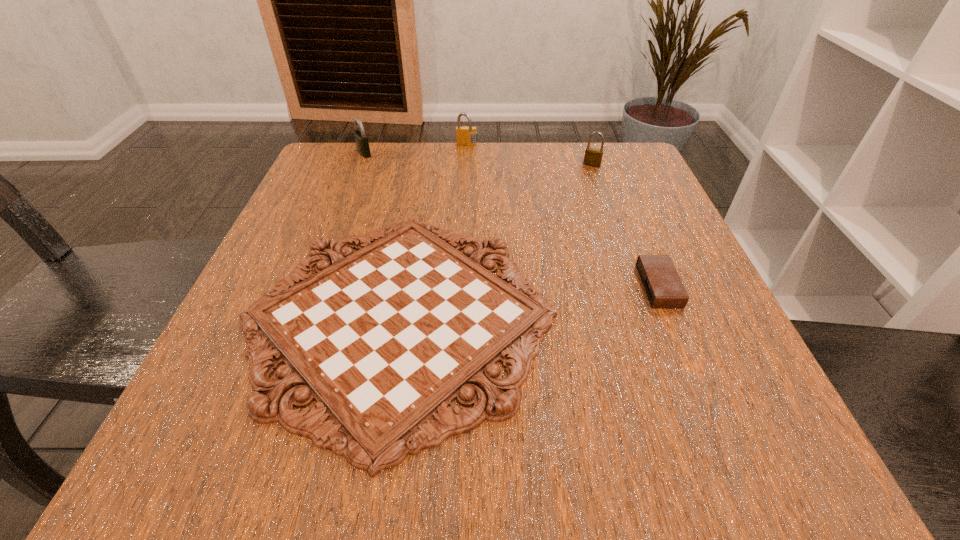
Locate an element on the screen. free space located on the front face of the alarm clock is located at coordinates (540, 286).

Locate an element on the screen. The height and width of the screenshot is (540, 960). vacant region located 0.060m on the front face of the alarm clock is located at coordinates (607, 286).

The width and height of the screenshot is (960, 540). I want to click on free location located 0.170m on the back of the chessboard, so click(423, 175).

Locate an element on the screen. The height and width of the screenshot is (540, 960). object that is positioned at the near edge is located at coordinates (384, 339).

This screenshot has height=540, width=960. I want to click on padlock located at the left edge, so click(361, 139).

At what (x,y) coordinates should I click in order to perform the action: click on chessboard situated at the left edge. Please return your answer as a coordinate pair (x, y). Image resolution: width=960 pixels, height=540 pixels. Looking at the image, I should click on (384, 339).

This screenshot has height=540, width=960. I want to click on padlock located at the right edge, so click(593, 157).

Identify the location of alarm clock that is at the right edge. Image resolution: width=960 pixels, height=540 pixels. (663, 286).

At what (x,y) coordinates should I click in order to perform the action: click on object that is at the far left corner. Please return your answer as a coordinate pair (x, y). Looking at the image, I should click on (361, 139).

Locate an element on the screen. object at the near left corner is located at coordinates (384, 339).